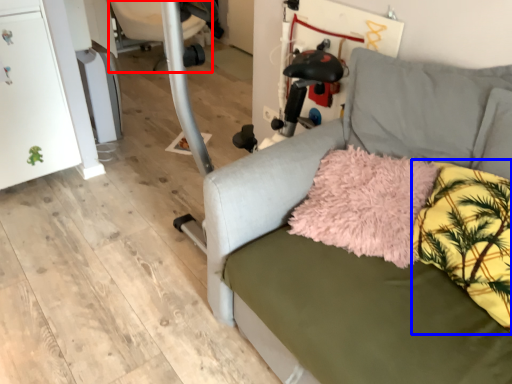
Question: Among these objects, which one is nearest to the camera, swivel chair (highlighted by a red box) or pillow (highlighted by a blue box)?

Choices:
 (A) swivel chair
 (B) pillow

Answer: (B)